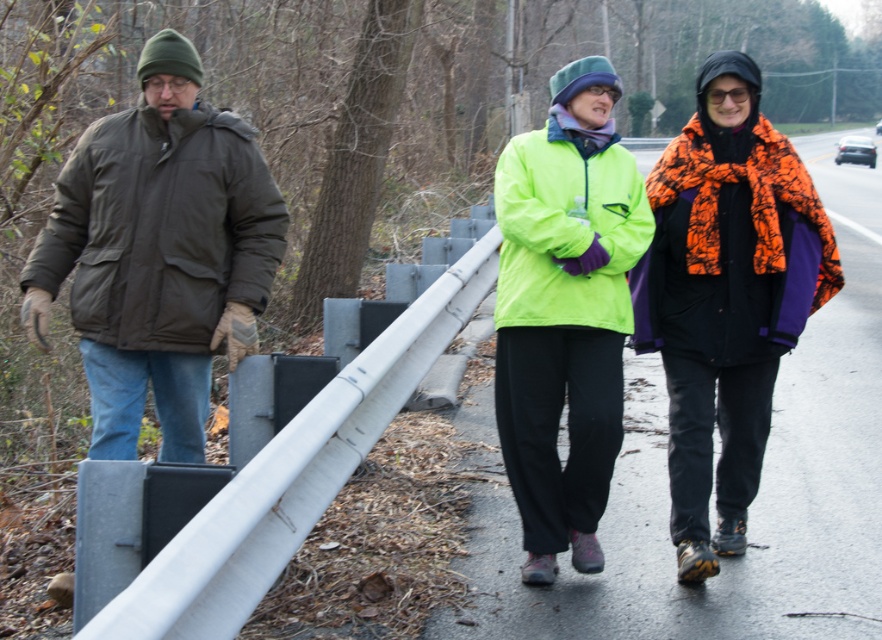
You are a photographer trying to capture a photo of the neon yellow jacket at center and the neon green jacket at center. Which jacket should you focus on first to ensure it appears larger in the photo?

The neon yellow jacket at center should be focused on first because it is closer to the viewer, making it appear larger in the photo compared to the neon green jacket at center which is farther away.

You are a photographer trying to capture a group photo of the dark green puffy jacket at left and the neon green fabric jacket at center. If you want to ensure both are in frame, should you position yourself to the left or right of the group?

You should position yourself to the right of the group because the dark green puffy jacket at left is to the left of neon green fabric jacket at center, so facing them from the right side would allow both jackets to be visible in the frame.

You are standing at the center of the road and want to find the neon yellow jacket at center. According to the coordinates, in which direction should you look?

The neon yellow jacket at center is located at coordinates point (726,296). Since you are at the center of the road, you should look towards the upper part of the image to find it.